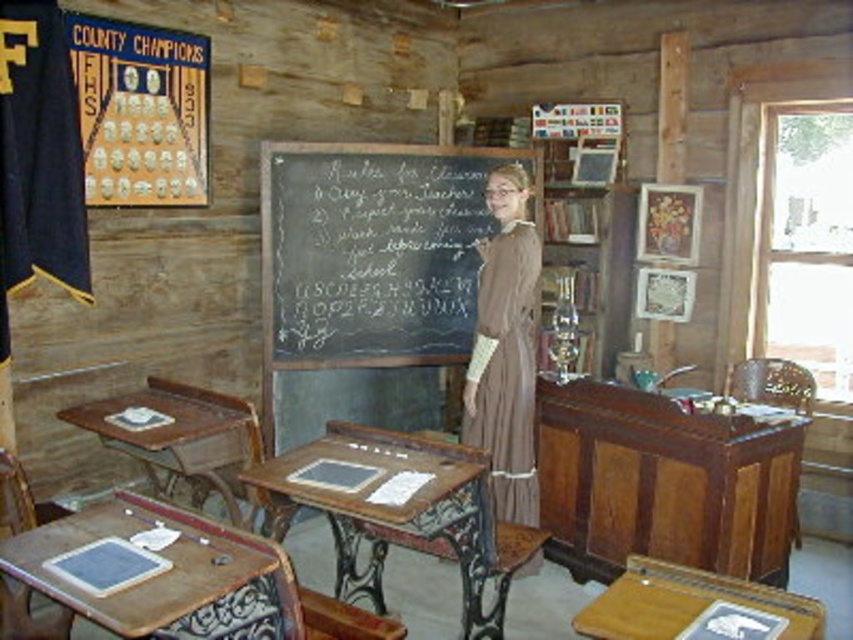
Question: Which of these objects is positioned farthest from the wooden chair at lower left?

Choices:
 (A) black chalkboard at center
 (B) wooden chair at right

Answer: (B)

Question: Is wooden desk at left positioned behind wooden chair at right?

Choices:
 (A) yes
 (B) no

Answer: (B)

Question: Considering the real-world distances, which object is farthest from the brown cotton dress at center?

Choices:
 (A) wooden desk at lower right
 (B) black chalkboard at center
 (C) wooden chair at right

Answer: (A)

Question: Can you confirm if wooden desk at lower left is positioned above brown cotton dress at center?

Choices:
 (A) yes
 (B) no

Answer: (B)

Question: Does wooden desk at left have a greater width compared to wooden chair at right?

Choices:
 (A) yes
 (B) no

Answer: (A)

Question: Which object is farther from the camera taking this photo?

Choices:
 (A) wooden desk at lower left
 (B) wooden desk at center

Answer: (B)